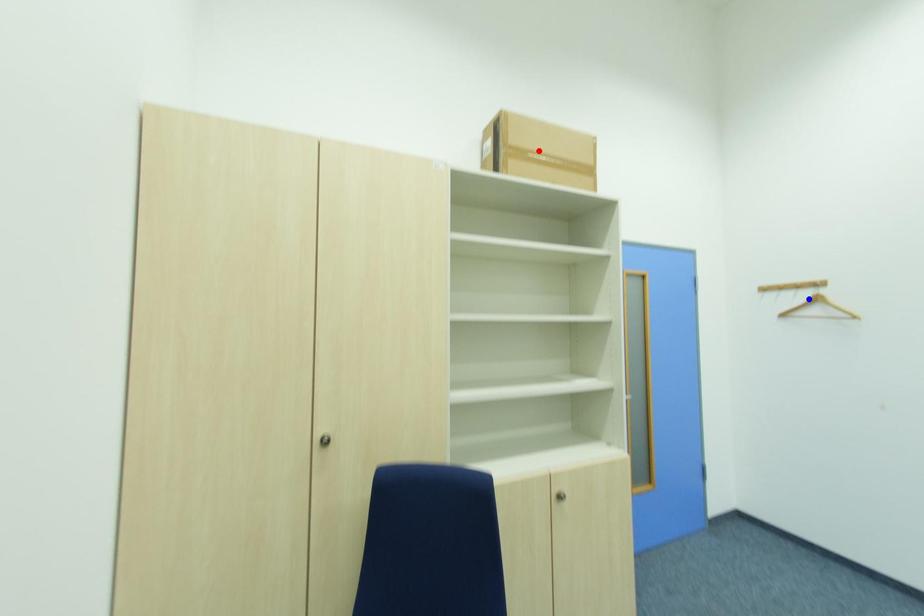
Question: Two points are marked on the image. Which point is closer to the camera?

Choices:
 (A) Blue point is closer.
 (B) Red point is closer.

Answer: (B)